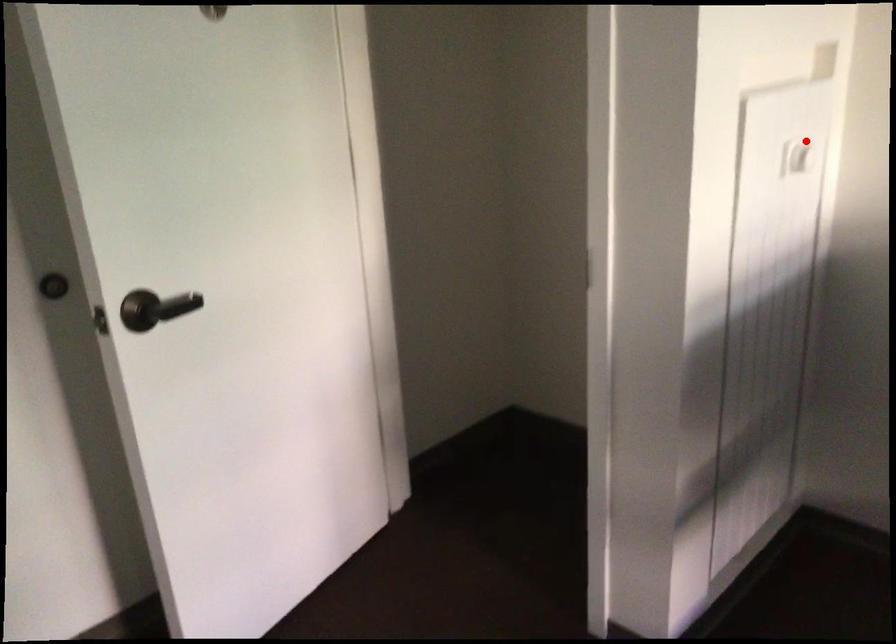
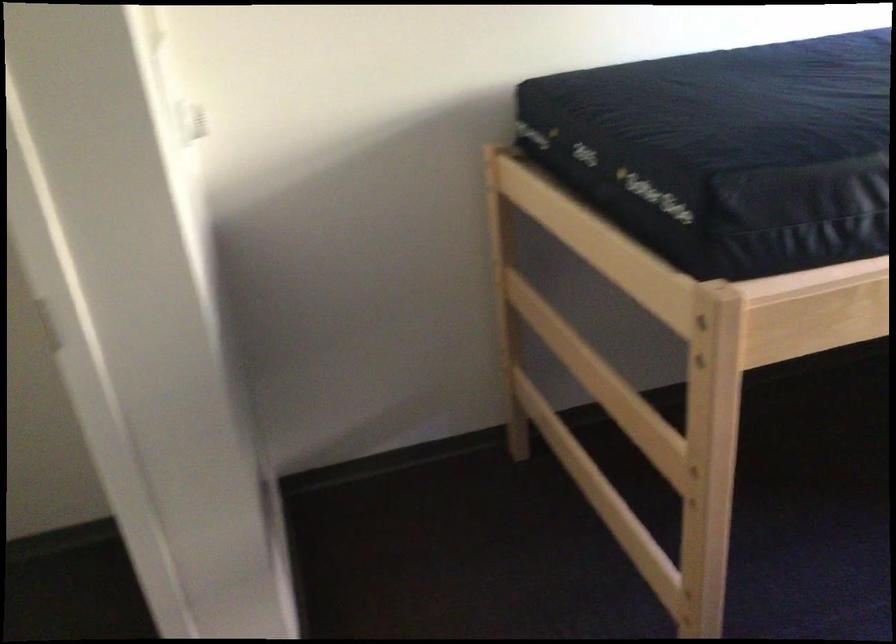
Locate, in the second image, the point that corresponds to the highlighted location in the first image.

(190, 117)